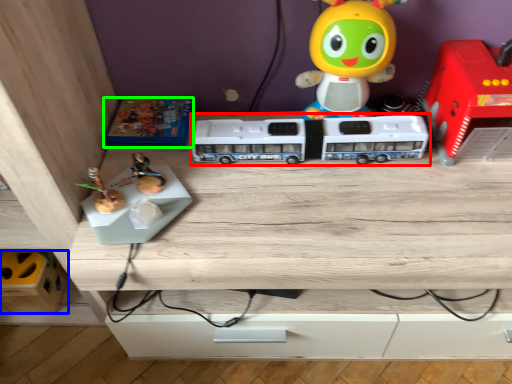
Question: Estimate the real-world distances between objects in this image. Which object is farther from toy (highlighted by a red box), toy (highlighted by a blue box) or toy (highlighted by a green box)?

Choices:
 (A) toy
 (B) toy

Answer: (A)